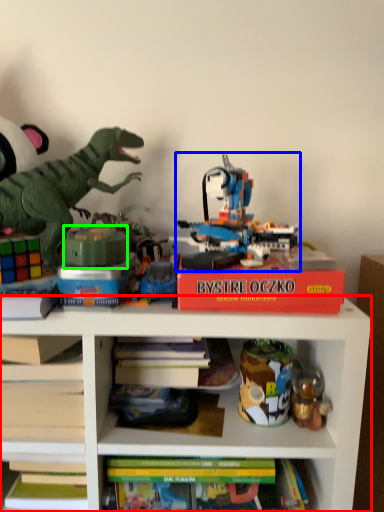
Question: Which object is the closest to the shelf (highlighted by a red box)? Choose among these: toy (highlighted by a blue box) or toy (highlighted by a green box).

Choices:
 (A) toy
 (B) toy

Answer: (A)